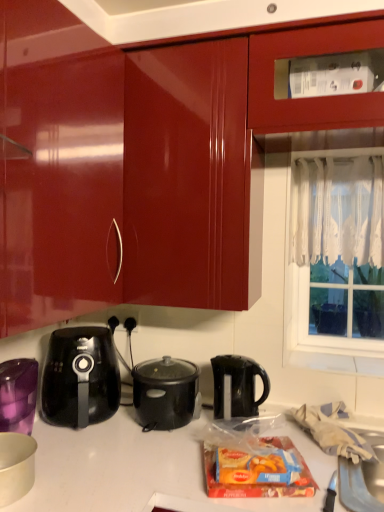
Question: Is white matte bowl at lower left, which is counted as the 2th kitchen appliance, starting from the back, to the left of black plastic slow cooker at center, the first kitchen appliance positioned from the back, from the viewer's perspective?

Choices:
 (A) no
 (B) yes

Answer: (B)

Question: Is black plastic slow cooker at center, the first kitchen appliance positioned from the back, located within white matte bowl at lower left, the 1th kitchen appliance viewed from the left?

Choices:
 (A) yes
 (B) no

Answer: (B)

Question: Is there a large distance between white matte bowl at lower left, which is counted as the 2th kitchen appliance, starting from the back, and black plastic slow cooker at center, which ranks as the 2th kitchen appliance in left-to-right order?

Choices:
 (A) yes
 (B) no

Answer: (B)

Question: Is white matte bowl at lower left, which is the 1th kitchen appliance from front to back, further to the viewer compared to black plastic slow cooker at center, which ranks as the 2th kitchen appliance in left-to-right order?

Choices:
 (A) no
 (B) yes

Answer: (A)

Question: Can you confirm if white matte bowl at lower left, which is counted as the 2th kitchen appliance, starting from the back, is bigger than black plastic slow cooker at center, the first kitchen appliance positioned from the back?

Choices:
 (A) no
 (B) yes

Answer: (A)

Question: Is black plastic kettle at center, the 1th kettle in the right-to-left sequence, wider or thinner than white lace curtain at window right?

Choices:
 (A) wide
 (B) thin

Answer: (A)

Question: In the image, is black plastic kettle at center, the 1th kettle in the right-to-left sequence, on the left side or the right side of white lace curtain at window right?

Choices:
 (A) right
 (B) left

Answer: (B)

Question: Is black plastic kettle at center, which is counted as the second kettle, starting from the left, bigger or smaller than white lace curtain at window right?

Choices:
 (A) small
 (B) big

Answer: (A)

Question: Does point (213, 401) appear closer or farther from the camera than point (347, 208)?

Choices:
 (A) farther
 (B) closer

Answer: (B)

Question: Considering the positions of point (175, 416) and point (104, 411), is point (175, 416) closer or farther from the camera than point (104, 411)?

Choices:
 (A) farther
 (B) closer

Answer: (B)

Question: In terms of size, does black plastic slow cooker at center, placed as the first kitchen appliance when sorted from right to left, appear bigger or smaller than black plastic kettle at lower left, the second kettle positioned from the right?

Choices:
 (A) small
 (B) big

Answer: (A)

Question: Would you say black plastic slow cooker at center, placed as the first kitchen appliance when sorted from right to left, is inside or outside black plastic kettle at lower left, acting as the first kettle starting from the left?

Choices:
 (A) outside
 (B) inside

Answer: (A)

Question: From a real-world perspective, is black plastic slow cooker at center, which ranks as the 2th kitchen appliance in left-to-right order, above or below black plastic kettle at lower left, the second kettle positioned from the right?

Choices:
 (A) above
 (B) below

Answer: (B)

Question: From a real-world perspective, relative to black plastic outlet at center, is black plastic kettle at center, the 1th kettle in the right-to-left sequence, vertically above or below?

Choices:
 (A) below
 (B) above

Answer: (A)

Question: Considering their positions, is black plastic kettle at center, the 1th kettle in the right-to-left sequence, located in front of or behind black plastic outlet at center?

Choices:
 (A) front
 (B) behind

Answer: (A)